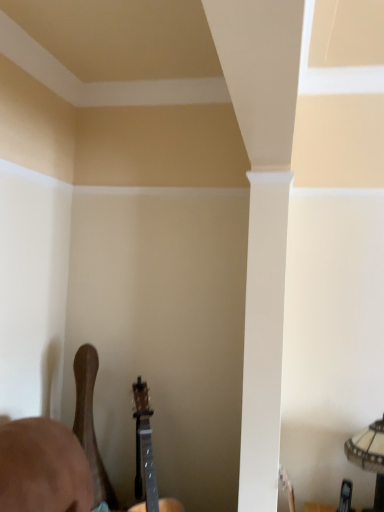
Question: Which direction should I rotate to look at wooden acoustic guitar at lower center, acting as the first guitar starting from the right?

Choices:
 (A) left
 (B) right

Answer: (A)

Question: Is wooden acoustic guitar at lower center, which is the 2th guitar from left to right, further to the viewer compared to glass textured lampshade at lower right?

Choices:
 (A) no
 (B) yes

Answer: (B)

Question: Does wooden acoustic guitar at lower center, which is the 2th guitar from left to right, have a smaller size compared to glass textured lampshade at lower right?

Choices:
 (A) yes
 (B) no

Answer: (B)

Question: From the image's perspective, does wooden acoustic guitar at lower center, acting as the first guitar starting from the right, appear higher than glass textured lampshade at lower right?

Choices:
 (A) no
 (B) yes

Answer: (A)

Question: Are wooden acoustic guitar at lower center, which is the 2th guitar from left to right, and glass textured lampshade at lower right located far from each other?

Choices:
 (A) no
 (B) yes

Answer: (A)

Question: Could you tell me if wooden acoustic guitar at lower center, which is the 2th guitar from left to right, is turned towards glass textured lampshade at lower right?

Choices:
 (A) no
 (B) yes

Answer: (B)

Question: Is wooden acoustic guitar at lower center, acting as the first guitar starting from the right, bigger than glass textured lampshade at lower right?

Choices:
 (A) no
 (B) yes

Answer: (B)

Question: Is wooden acoustic guitar at lower left, the 1th guitar when ordered from left to right, located outside wooden acoustic guitar at lower center, which is the 2th guitar from left to right?

Choices:
 (A) no
 (B) yes

Answer: (B)

Question: Considering the relative positions of wooden acoustic guitar at lower left, arranged as the second guitar when viewed from the right, and wooden acoustic guitar at lower center, acting as the first guitar starting from the right, in the image provided, is wooden acoustic guitar at lower left, arranged as the second guitar when viewed from the right, to the left of wooden acoustic guitar at lower center, acting as the first guitar starting from the right, from the viewer's perspective?

Choices:
 (A) yes
 (B) no

Answer: (A)

Question: Are wooden acoustic guitar at lower left, the 1th guitar when ordered from left to right, and wooden acoustic guitar at lower center, which is the 2th guitar from left to right, making contact?

Choices:
 (A) yes
 (B) no

Answer: (B)

Question: Is wooden acoustic guitar at lower left, the 1th guitar when ordered from left to right, far away from wooden acoustic guitar at lower center, acting as the first guitar starting from the right?

Choices:
 (A) yes
 (B) no

Answer: (B)

Question: From the image's perspective, is wooden acoustic guitar at lower left, the 1th guitar when ordered from left to right, above wooden acoustic guitar at lower center, which is the 2th guitar from left to right?

Choices:
 (A) yes
 (B) no

Answer: (A)

Question: Does wooden acoustic guitar at lower left, the 1th guitar when ordered from left to right, have a smaller size compared to wooden acoustic guitar at lower center, which is the 2th guitar from left to right?

Choices:
 (A) no
 (B) yes

Answer: (B)

Question: Is wooden acoustic guitar at lower left, arranged as the second guitar when viewed from the right, far from glass textured lampshade at lower right?

Choices:
 (A) no
 (B) yes

Answer: (B)